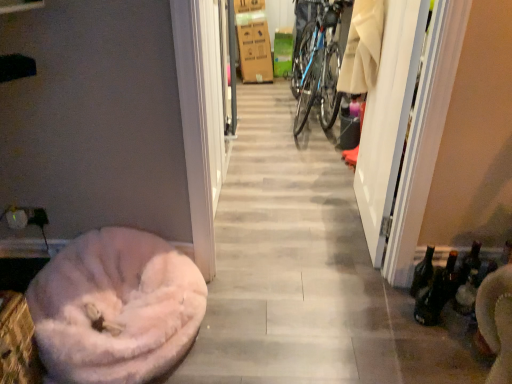
Question: Is brown cardboard box at upper center completely or partially outside of blue metallic bicycle at center?

Choices:
 (A) no
 (B) yes

Answer: (B)

Question: Considering the relative positions of brown cardboard box at upper center and blue metallic bicycle at center in the image provided, is brown cardboard box at upper center to the right of blue metallic bicycle at center from the viewer's perspective?

Choices:
 (A) no
 (B) yes

Answer: (A)

Question: Is brown cardboard box at upper center directly adjacent to blue metallic bicycle at center?

Choices:
 (A) no
 (B) yes

Answer: (A)

Question: Would you consider brown cardboard box at upper center to be distant from blue metallic bicycle at center?

Choices:
 (A) no
 (B) yes

Answer: (B)

Question: Considering the relative sizes of brown cardboard box at upper center and blue metallic bicycle at center in the image provided, is brown cardboard box at upper center thinner than blue metallic bicycle at center?

Choices:
 (A) no
 (B) yes

Answer: (B)

Question: From their relative heights in the image, would you say brown cardboard box at upper center is taller or shorter than fuzzy pink dog bed at lower left?

Choices:
 (A) tall
 (B) short

Answer: (A)

Question: Would you say brown cardboard box at upper center is to the left or to the right of fuzzy pink dog bed at lower left in the picture?

Choices:
 (A) left
 (B) right

Answer: (B)

Question: In the image, is brown cardboard box at upper center positioned in front of or behind fuzzy pink dog bed at lower left?

Choices:
 (A) front
 (B) behind

Answer: (B)

Question: From the image's perspective, is brown cardboard box at upper center positioned above or below fuzzy pink dog bed at lower left?

Choices:
 (A) below
 (B) above

Answer: (B)

Question: In terms of height, does blue metallic bicycle at center look taller or shorter compared to brown cardboard box at upper center?

Choices:
 (A) short
 (B) tall

Answer: (B)

Question: In the image, is blue metallic bicycle at center positioned in front of or behind brown cardboard box at upper center?

Choices:
 (A) front
 (B) behind

Answer: (A)

Question: Based on their sizes in the image, would you say blue metallic bicycle at center is bigger or smaller than brown cardboard box at upper center?

Choices:
 (A) big
 (B) small

Answer: (A)

Question: Considering the positions of point (312, 43) and point (261, 72), is point (312, 43) closer or farther from the camera than point (261, 72)?

Choices:
 (A) farther
 (B) closer

Answer: (B)

Question: From a real-world perspective, is fuzzy pink dog bed at lower left physically located above or below white glossy screen door at right?

Choices:
 (A) below
 (B) above

Answer: (A)

Question: Which is correct: fuzzy pink dog bed at lower left is inside white glossy screen door at right, or outside of it?

Choices:
 (A) inside
 (B) outside

Answer: (B)